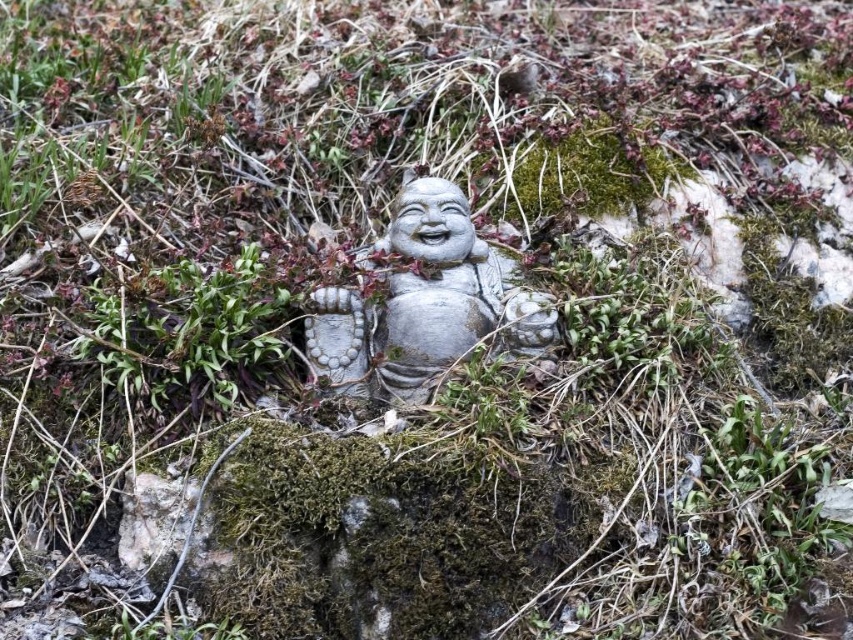
From the picture: How distant is satin silver statue at center from green moss at center?

satin silver statue at center is 9.69 inches from green moss at center.

Describe the element at coordinates (425, 304) in the screenshot. I see `satin silver statue at center` at that location.

The width and height of the screenshot is (853, 640). I want to click on satin silver statue at center, so click(425, 304).

At what (x,y) coordinates should I click in order to perform the action: click on satin silver statue at center. Please return your answer as a coordinate pair (x, y). Looking at the image, I should click on (425, 304).